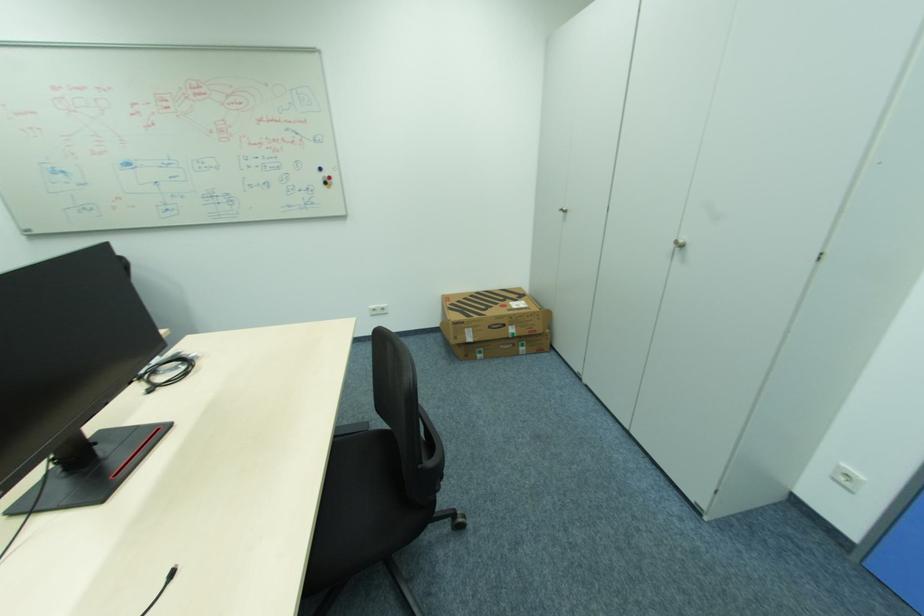
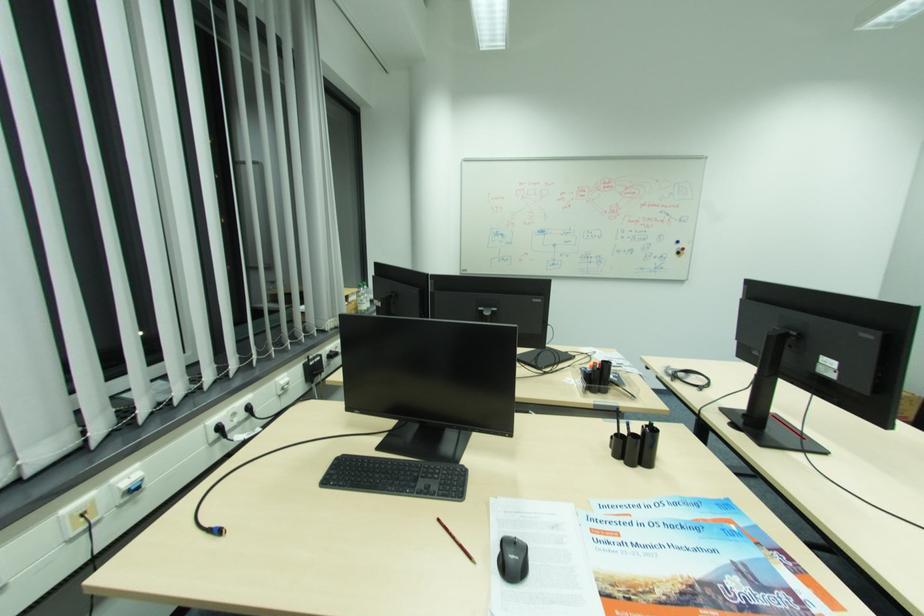
In the scene shown: In a continuous first-person perspective shot, in which direction is the camera moving?

The cameraman walked toward left, backward.